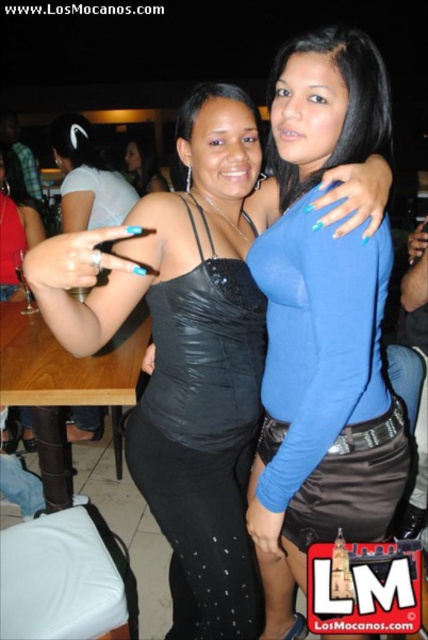
Question: Which object appears farthest from the camera in this image?

Choices:
 (A) matte black dress at center
 (B) matte black top at upper left
 (C) black satin dress at center

Answer: (A)

Question: Is the position of blue satin top at center more distant than that of matte black top at upper left?

Choices:
 (A) yes
 (B) no

Answer: (B)

Question: Is black satin dress at center bigger than matte black dress at center?

Choices:
 (A) yes
 (B) no

Answer: (A)

Question: Is black satin dress at center below matte black top at upper left?

Choices:
 (A) yes
 (B) no

Answer: (A)

Question: Considering the real-world distances, which object is farthest from the matte black dress at center?

Choices:
 (A) matte black top at upper left
 (B) blue satin top at center
 (C) black satin dress at center

Answer: (B)

Question: Among these points, which one is farthest from the camera?

Choices:
 (A) (178, 509)
 (B) (71, 131)
 (C) (344, 32)

Answer: (B)